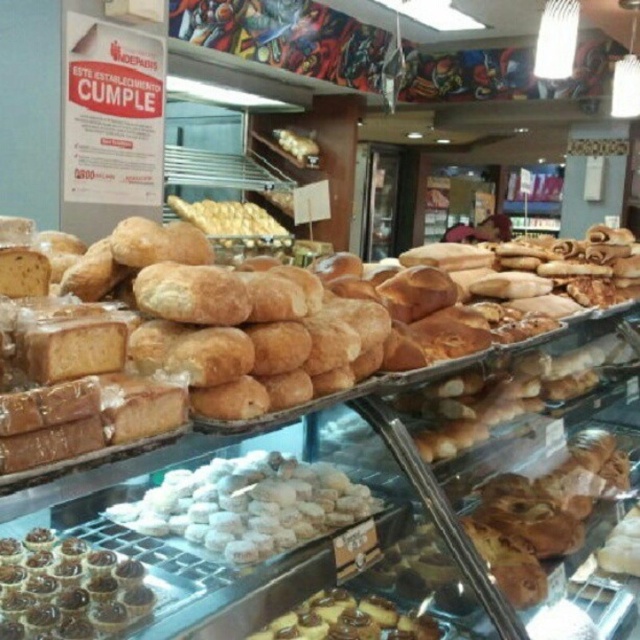
You are a customer at the bakery and want to buy both the white sugared cookies at center and the chocolate glazed tartlets at lower left. Based on their positions in the display case, which item is placed higher up?

The white sugared cookies at center is placed higher up than the chocolate glazed tartlets at lower left.

You are a customer at the bakery and want to place an order. You see the white sugared cookies at center and the chocolate glazed tartlets at lower left. Which item has a greater width?

The white sugared cookies at center has a greater width than the chocolate glazed tartlets at lower left.

You are a customer at the bakery and want to point out the golden brown crusty loaf at center and the chocolate glazed pastry at lower center to the cashier. Which one is positioned higher in the display case?

The golden brown crusty loaf at center is located above the chocolate glazed pastry at lower center, so it is positioned higher in the display case.